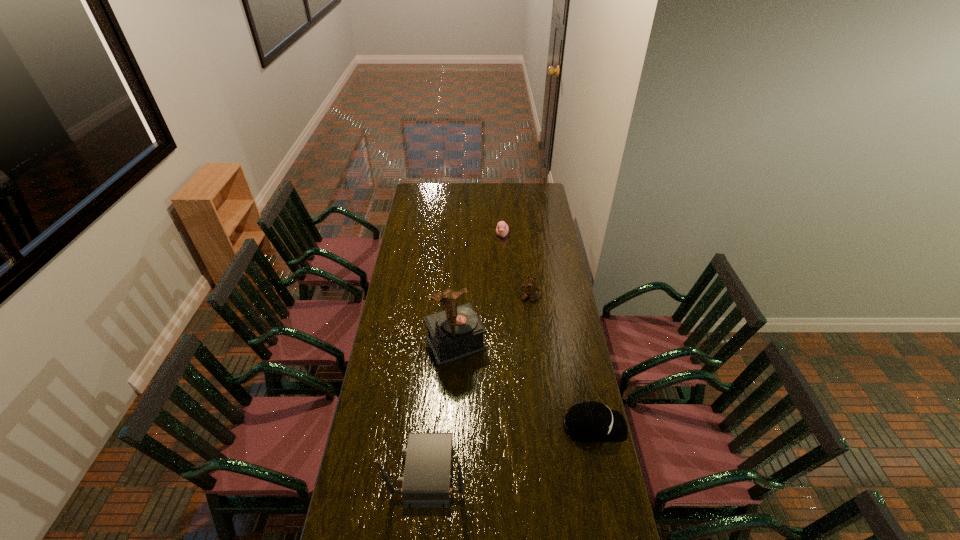
What are the coordinates of `vacant space on the desktop that is between the fourth shortest object and the rightmost object and is positioned on the front-facing side of the duckling` in the screenshot? It's located at (503, 450).

You are a GUI agent. You are given a task and a screenshot of the screen. Output one action in this format:
    pyautogui.click(x=<x>, y=<y>)
    Task: Click on the vacant spot on the desktop that is between the router and the rightmost object and is positioned at the face of the second object from right to left
    The height and width of the screenshot is (540, 960).
    Given the screenshot: What is the action you would take?
    pyautogui.click(x=492, y=453)

Find the location of `free spot on the desktop that is between the second tallest object and the rightmost object and is positioned at the horn opening of the phonograph_record`. free spot on the desktop that is between the second tallest object and the rightmost object and is positioned at the horn opening of the phonograph_record is located at coordinates (509, 448).